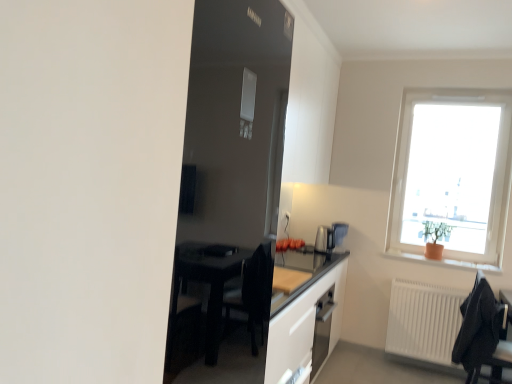
Question: From a real-world perspective, is white matte radiator at lower right positioned above or below transparent glass window at upper right?

Choices:
 (A) above
 (B) below

Answer: (B)

Question: From their relative heights in the image, would you say white matte radiator at lower right is taller or shorter than transparent glass window at upper right?

Choices:
 (A) short
 (B) tall

Answer: (A)

Question: Based on their relative distances, which object is farther from the white matte radiator at lower right?

Choices:
 (A) orange clay pot at right
 (B) black fabric chair at lower right
 (C) transparent glass window at upper right
 (D) glossy black table at center
 (E) satin metallic coffee machine at right

Answer: (D)

Question: Which object is positioned closest to the transparent glass window at upper right?

Choices:
 (A) white matte radiator at lower right
 (B) black fabric chair at lower right
 (C) orange clay pot at right
 (D) satin metallic coffee machine at right
 (E) glossy black table at center

Answer: (C)